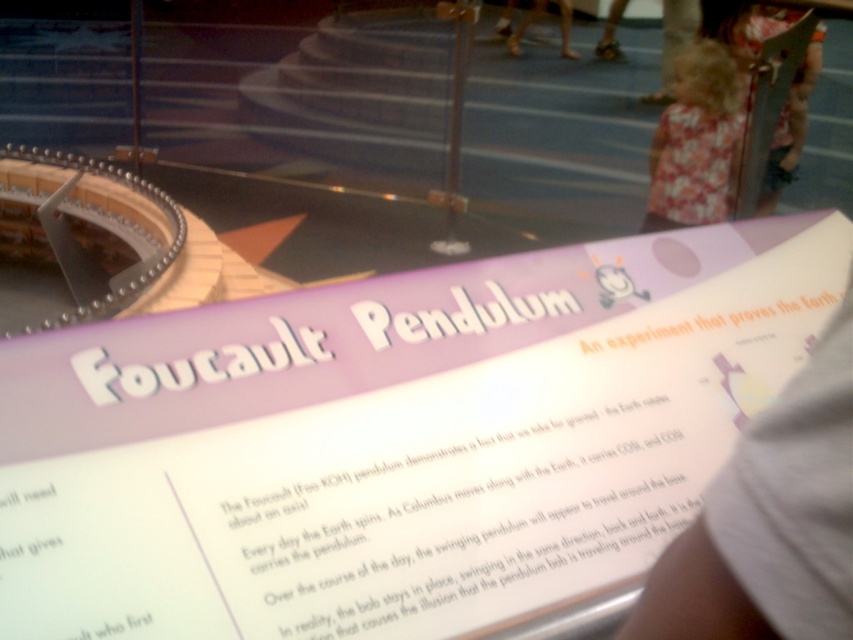
Question: Which object appears closest to the camera in this image?

Choices:
 (A) white paper sign at center
 (B) floral dress at right
 (C) fluffy pink dress at upper right
 (D) white fabric at lower right

Answer: (D)

Question: Is white fabric at lower right wider than fluffy pink dress at upper right?

Choices:
 (A) no
 (B) yes

Answer: (A)

Question: Which point is closer to the camera?

Choices:
 (A) (393, 628)
 (B) (779, 164)
 (C) (718, 472)

Answer: (A)

Question: Which of the following is the closest to the observer?

Choices:
 (A) (142, 554)
 (B) (795, 636)

Answer: (B)

Question: Is white fabric at lower right in front of floral dress at right?

Choices:
 (A) no
 (B) yes

Answer: (B)

Question: From the image, what is the correct spatial relationship of white paper sign at center in relation to fluffy pink dress at upper right?

Choices:
 (A) left
 (B) right

Answer: (A)